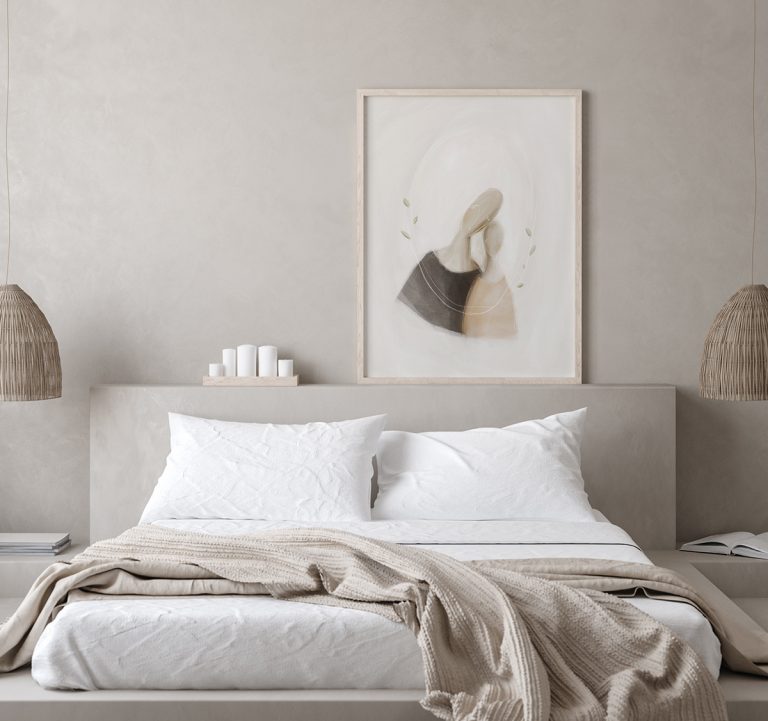
The height and width of the screenshot is (721, 768). I want to click on pillows, so click(485, 463), click(319, 466).